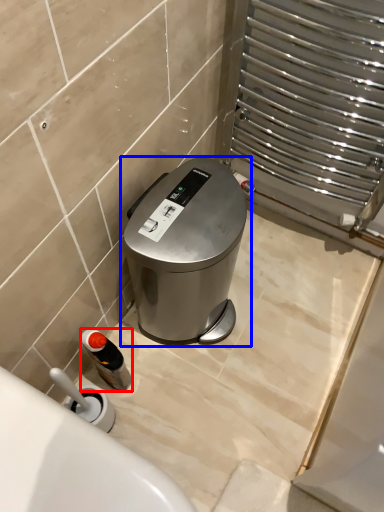
Question: Among these objects, which one is nearest to the camera, bottle (highlighted by a red box) or waste container (highlighted by a blue box)?

Choices:
 (A) bottle
 (B) waste container

Answer: (B)